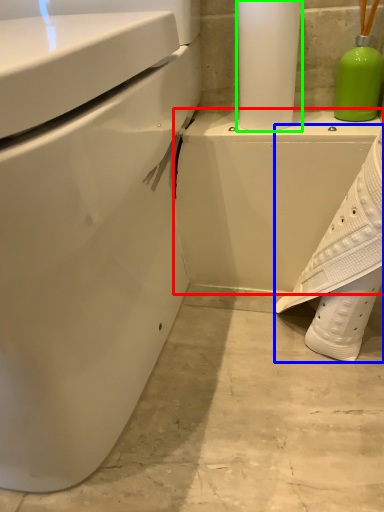
Question: Which is nearer to the porcelain (highlighted by a red box)? shoe (highlighted by a blue box) or paper towel (highlighted by a green box).

Choices:
 (A) shoe
 (B) paper towel

Answer: (A)